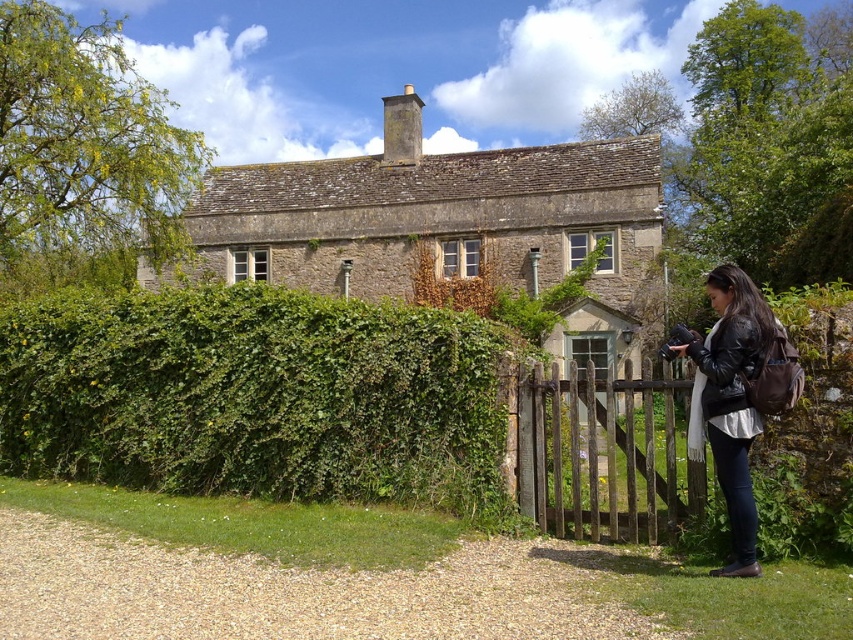
Can you confirm if green leafy hedge at left is taller than stone cottage at center?

No, green leafy hedge at left is not taller than stone cottage at center.

Between green leafy hedge at left and stone cottage at center, which one has more height?

stone cottage at center is taller.

Measure the distance between green leafy hedge at left and camera.

A distance of 28.87 feet exists between green leafy hedge at left and camera.

The width and height of the screenshot is (853, 640). I want to click on green leafy hedge at left, so click(x=254, y=396).

Between green leafy hedge at left and black leather jacket at lower right, which one appears on the left side from the viewer's perspective?

green leafy hedge at left is more to the left.

Between green leafy hedge at left and black leather jacket at lower right, which one has less height?

With less height is black leather jacket at lower right.

Image resolution: width=853 pixels, height=640 pixels. What are the coordinates of `green leafy hedge at left` in the screenshot? It's located at (254, 396).

Is stone cottage at center positioned behind black leather jacket at lower right?

Yes, stone cottage at center is behind black leather jacket at lower right.

Does stone cottage at center appear on the right side of black leather jacket at lower right?

No, stone cottage at center is not to the right of black leather jacket at lower right.

Between point (515, 257) and point (711, 273), which one is positioned in front?

Point (711, 273)

At what (x,y) coordinates should I click in order to perform the action: click on stone cottage at center. Please return your answer as a coordinate pair (x, y). Image resolution: width=853 pixels, height=640 pixels. Looking at the image, I should click on (450, 225).